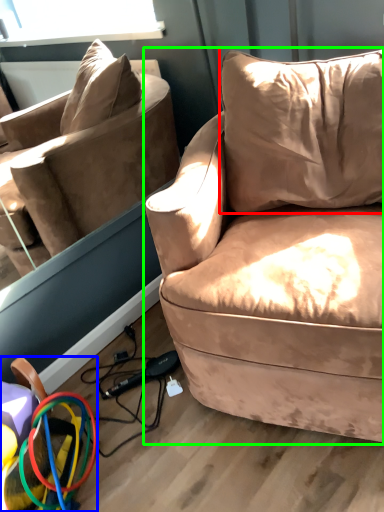
Question: Considering the real-world distances, which object is closest to pillow (highlighted by a red box)? toy (highlighted by a blue box) or studio couch (highlighted by a green box).

Choices:
 (A) toy
 (B) studio couch

Answer: (B)